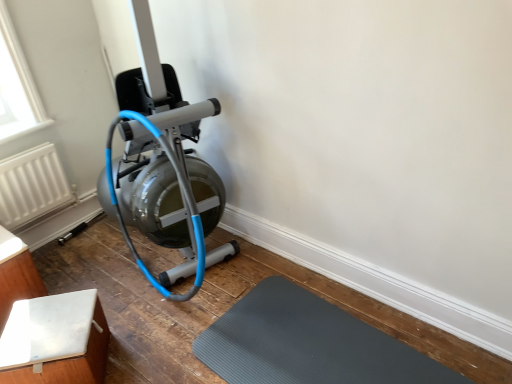
The width and height of the screenshot is (512, 384). Find the location of `vacant area to the right of white matte table at lower left, the 1th furniture when ordered from right to left`. vacant area to the right of white matte table at lower left, the 1th furniture when ordered from right to left is located at coordinates (148, 350).